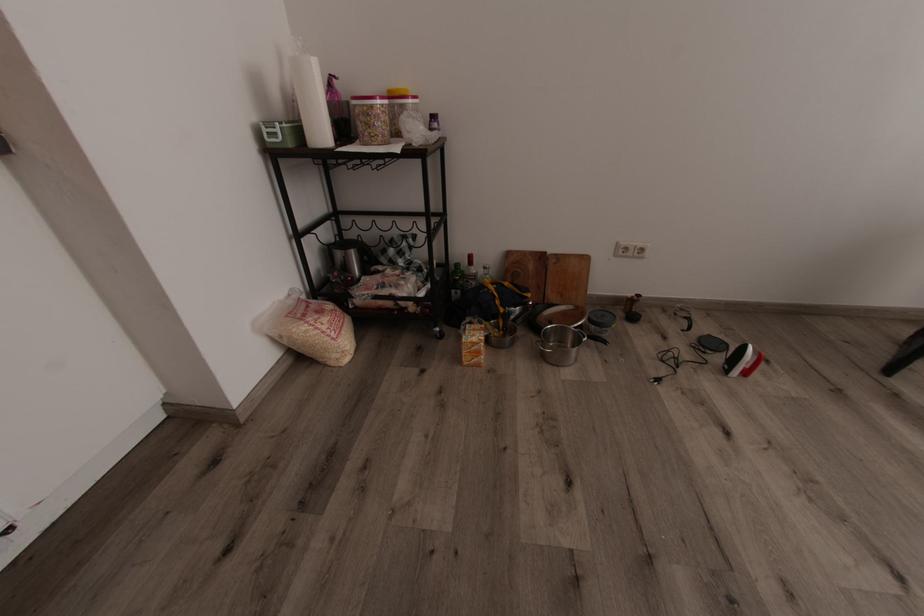
Image resolution: width=924 pixels, height=616 pixels. I want to click on black pan handle, so click(x=593, y=336).